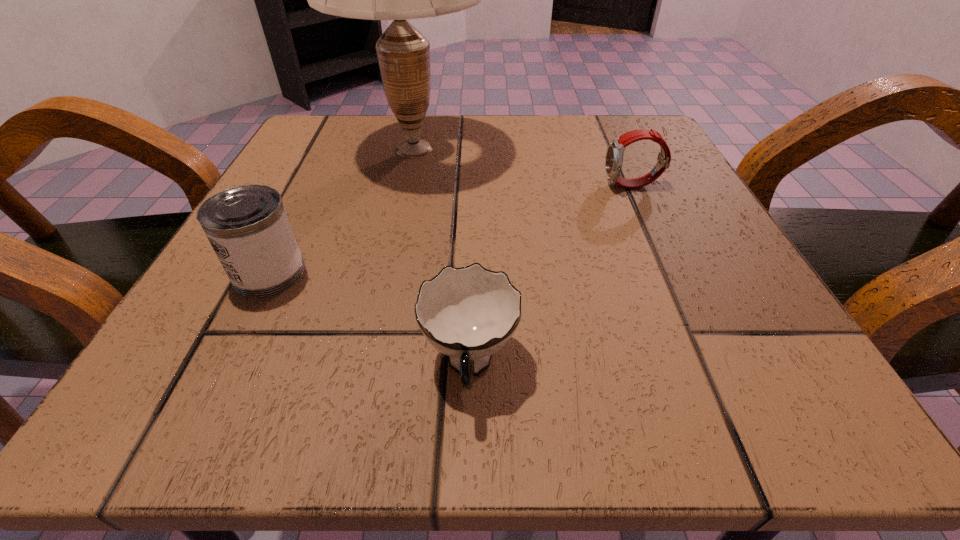
At what (x,y) coordinates should I click in order to perform the action: click on empty space between the lampshade and the cup. Please return your answer as a coordinate pair (x, y). This screenshot has height=540, width=960. Looking at the image, I should click on (442, 257).

At what (x,y) coordinates should I click in order to perform the action: click on empty space that is in between the second nearest object and the tallest object. Please return your answer as a coordinate pair (x, y). Looking at the image, I should click on (342, 211).

At what (x,y) coordinates should I click in order to perform the action: click on empty space between the second nearest object and the lampshade. Please return your answer as a coordinate pair (x, y). The image size is (960, 540). Looking at the image, I should click on (342, 211).

The image size is (960, 540). I want to click on vacant region between the lampshade and the can, so click(342, 211).

Locate an element on the screen. Image resolution: width=960 pixels, height=540 pixels. vacant area that lies between the third farthest object and the lampshade is located at coordinates (342, 211).

Locate an element on the screen. The height and width of the screenshot is (540, 960). free space between the can and the watch is located at coordinates (451, 229).

Identify the location of vacant point located between the tallest object and the can. The width and height of the screenshot is (960, 540). (342, 211).

Locate an element on the screen. The width and height of the screenshot is (960, 540). vacant area that lies between the lampshade and the rightmost object is located at coordinates (523, 167).

You are a GUI agent. You are given a task and a screenshot of the screen. Output one action in this format:
    pyautogui.click(x=<x>, y=<y>)
    Task: Click on the empty space that is in between the cup and the lampshade
    
    Given the screenshot: What is the action you would take?
    click(442, 257)

Image resolution: width=960 pixels, height=540 pixels. Identify the location of empty space between the cup and the second nearest object. (370, 319).